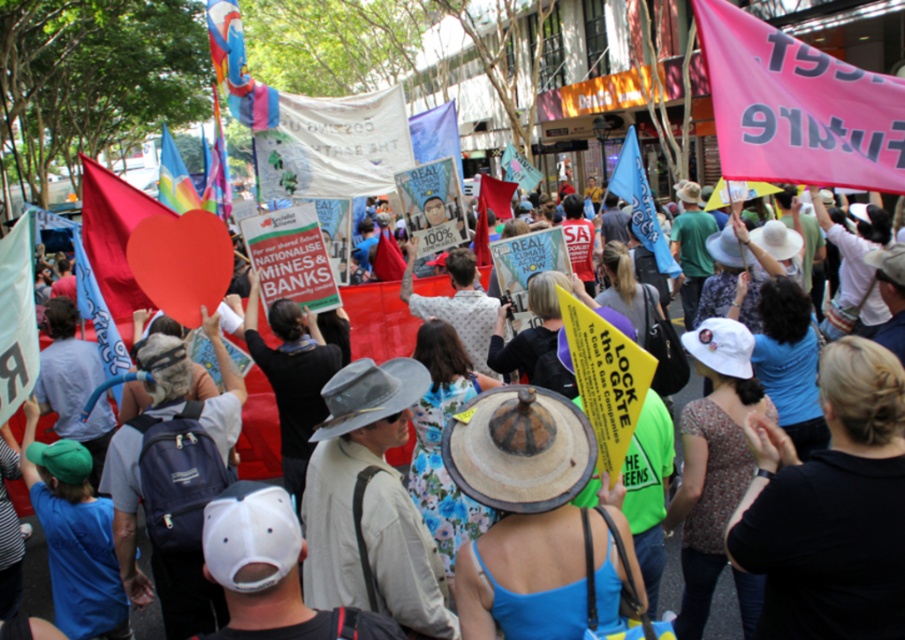
You are a photographer trying to capture the pink fabric banner at upper right in the protest scene. If your camera has a minimum focusing distance of 4 meters, will you be able to take a clear photo of the banner?

The pink fabric banner at upper right is 3.68 meters away from the camera, which is closer than the minimum focusing distance of 4 meters. Therefore, the camera cannot focus on the banner clearly.

Looking at the protest scene, where is the pink fabric banner at upper right in relation to the pink fabric banner at center?

The pink fabric banner at upper right is located to the right of the pink fabric banner at center.

You are a photographer trying to capture the yellow paper sign at center in the protest scene. The camera is currently focused on the point at coordinates point (378, 321). Is the camera already focused on the yellow paper sign at center?

The yellow paper sign at center is represented by the point (378, 321), so the camera is already focused on the yellow paper sign at center.